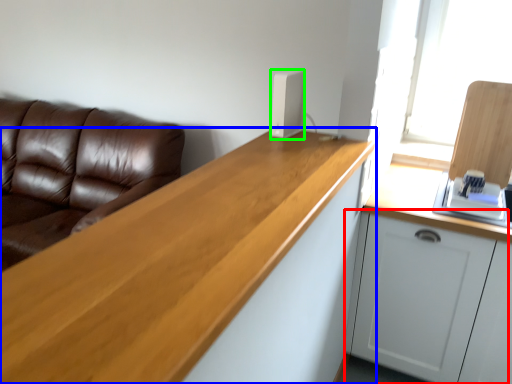
Question: Which object is positioned farthest from cabinetry (highlighted by a red box)? Select from countertop (highlighted by a blue box) and appliance (highlighted by a green box).

Choices:
 (A) countertop
 (B) appliance

Answer: (B)